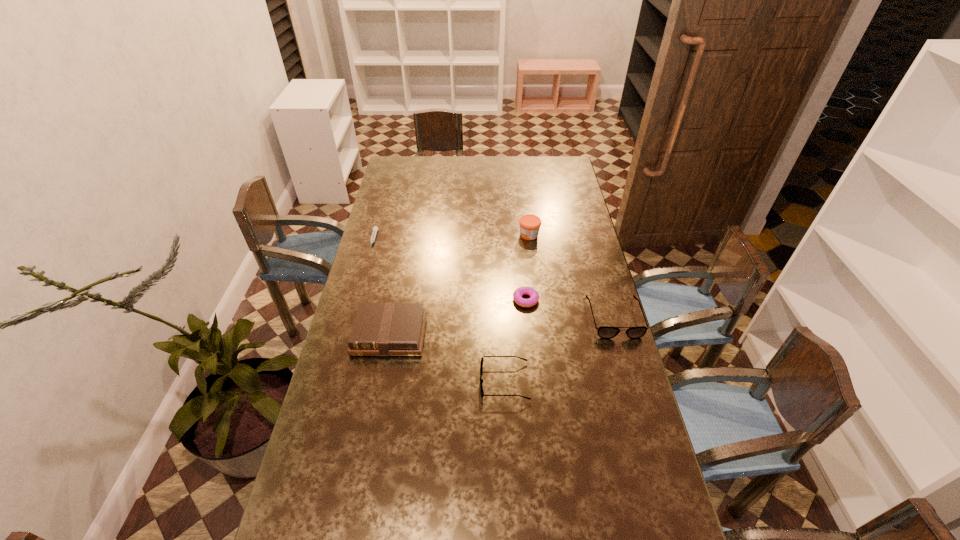
What are the coordinates of `vacant space located on the front-facing side of the third shortest object` in the screenshot? It's located at (349, 381).

In order to click on vacant area situated 0.090m on the front-facing side of the third shortest object in this screenshot , I will do `click(450, 381)`.

This screenshot has width=960, height=540. I want to click on free point located 0.300m on the front-facing side of the farther spectacles, so click(645, 424).

The height and width of the screenshot is (540, 960). Identify the location of vacant region located on the front label of the tallest object. (506, 235).

Find the location of `vacant area located on the front label of the tallest object`. vacant area located on the front label of the tallest object is located at coordinates (457, 235).

This screenshot has height=540, width=960. I want to click on vacant region located 0.150m on the front label of the tallest object, so click(x=483, y=235).

Identify the location of free space located at the needle end of the shortest object. This screenshot has height=540, width=960. (359, 292).

The image size is (960, 540). I want to click on vacant space situated on the spine side of the fifth object from right to left, so click(372, 424).

Where is `free location located on the front of the doughnut`? This screenshot has width=960, height=540. free location located on the front of the doughnut is located at coordinates (538, 413).

This screenshot has height=540, width=960. I want to click on syringe that is positioned at the left edge, so click(375, 228).